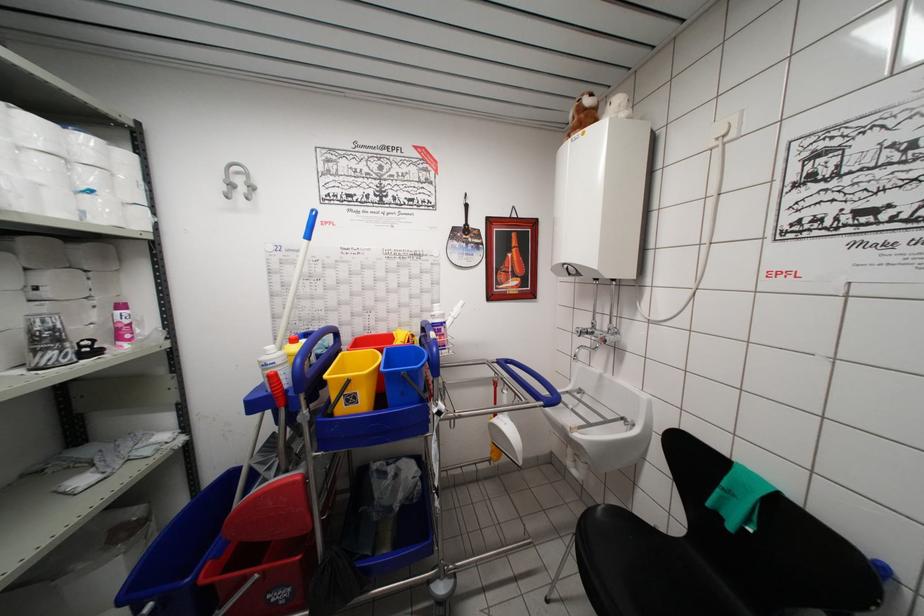
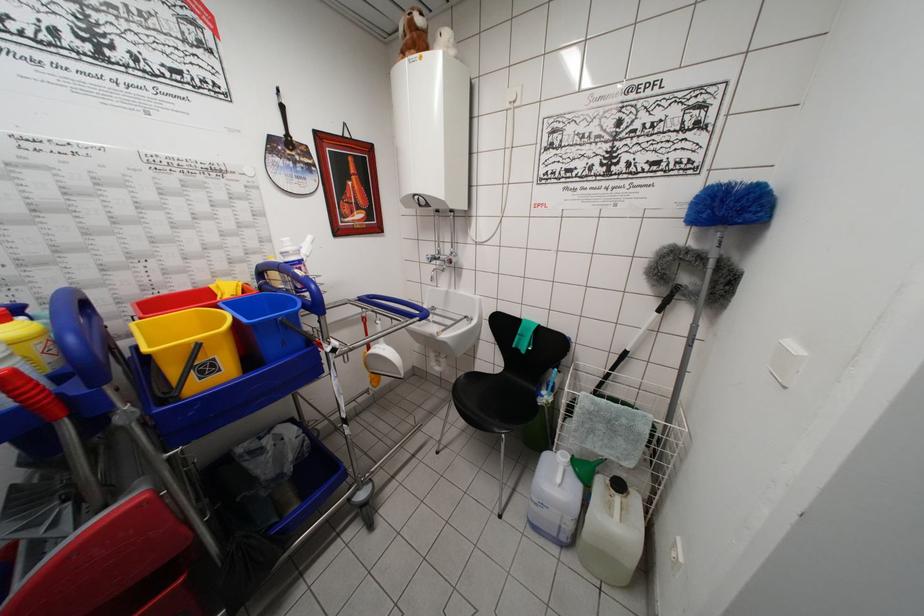
Find the pixel in the second image that matches point (409, 378) in the first image.

(287, 323)